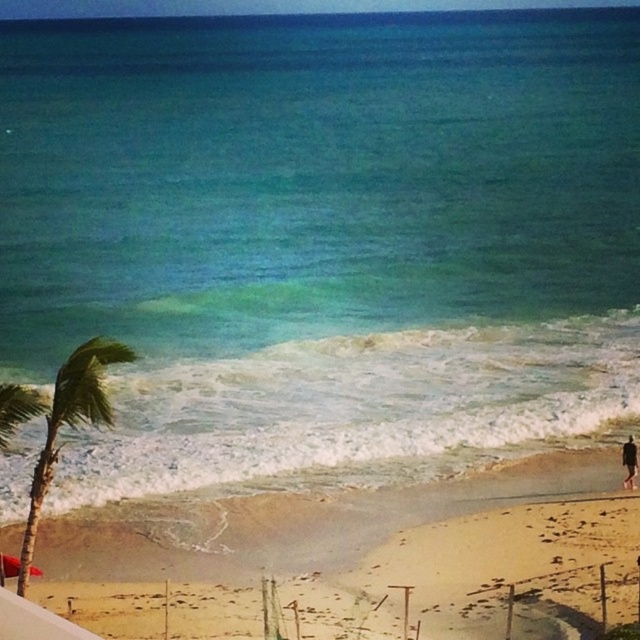
You are standing on the beach and want to take a photo of the green leafy palm tree at left and the black fabric person at lower right. Which object should you zoom in on to make them appear the same size in your photo?

The green leafy palm tree at left is taller than the black fabric person at lower right, so you should zoom in on the black fabric person at lower right to make them appear the same size in the photo.

You are standing on the sandy beach at lower center and want to reach the black fabric person at lower right. Which direction should you walk to get closer to them?

You should walk to the right because the black fabric person at lower right is positioned to the right of the sandy beach at lower center.